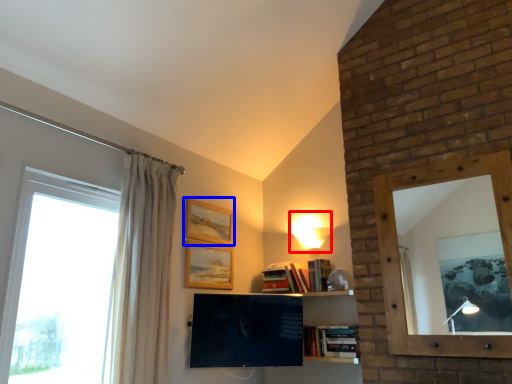
Question: Among these objects, which one is nearest to the camera, light (highlighted by a red box) or picture frame (highlighted by a blue box)?

Choices:
 (A) light
 (B) picture frame

Answer: (B)